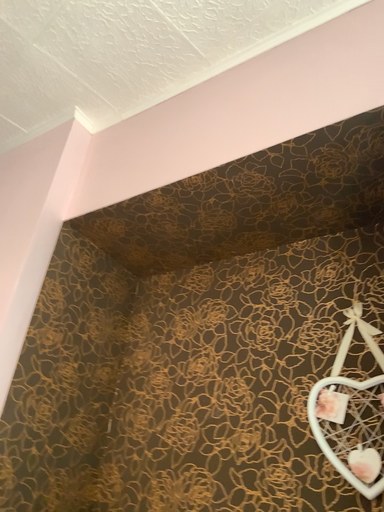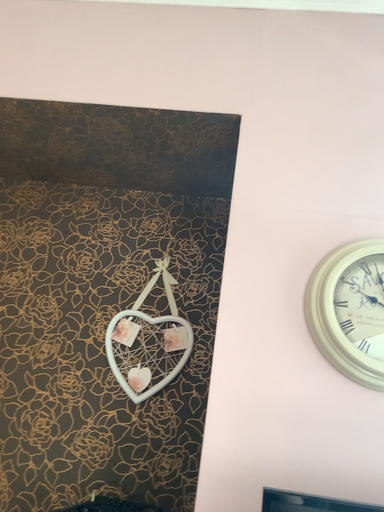
Question: Which way did the camera rotate in the video?

Choices:
 (A) rotated left
 (B) rotated right

Answer: (B)